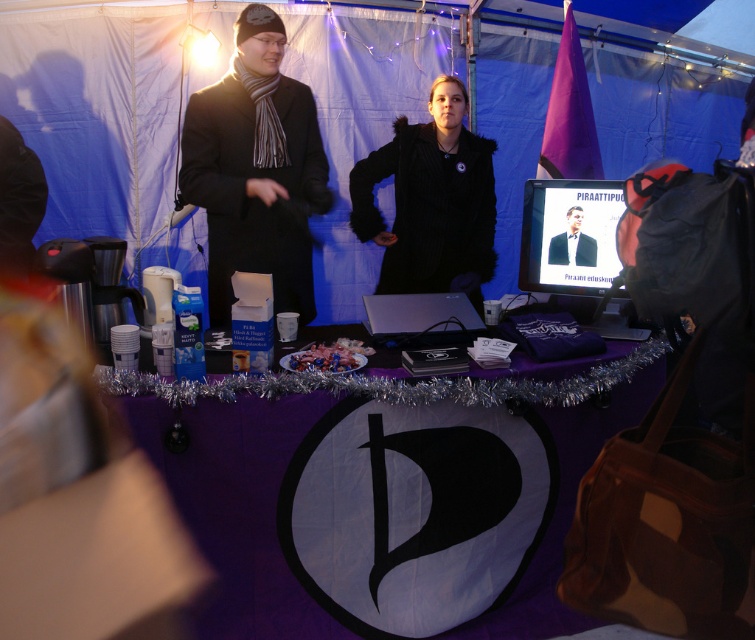
Who is more forward, (100, 172) or (262, 211)?

Point (262, 211) is in front.

Which is above, purple fabric tent at center or black woolen coat at center?

purple fabric tent at center

Is point (5, 24) behind point (251, 237)?

Yes.

The height and width of the screenshot is (640, 755). I want to click on purple fabric tent at center, so click(x=96, y=113).

Is matte black monitor at upper right above matte black suit at center?

Correct, matte black monitor at upper right is located above matte black suit at center.

You are a GUI agent. You are given a task and a screenshot of the screen. Output one action in this format:
    pyautogui.click(x=<x>, y=<y>)
    Task: Click on the matte black monitor at upper right
    The height and width of the screenshot is (640, 755).
    Given the screenshot: What is the action you would take?
    pyautogui.click(x=569, y=236)

Does black woolen coat at center lie behind matte black monitor at upper right?

Yes, black woolen coat at center is further from the viewer.

Is black woolen coat at center to the right of matte black monitor at upper right from the viewer's perspective?

No, black woolen coat at center is not to the right of matte black monitor at upper right.

Is point (304, 204) more distant than point (569, 182)?

Yes, it is.

Where is `black woolen coat at center`? The image size is (755, 640). black woolen coat at center is located at coordinates (254, 168).